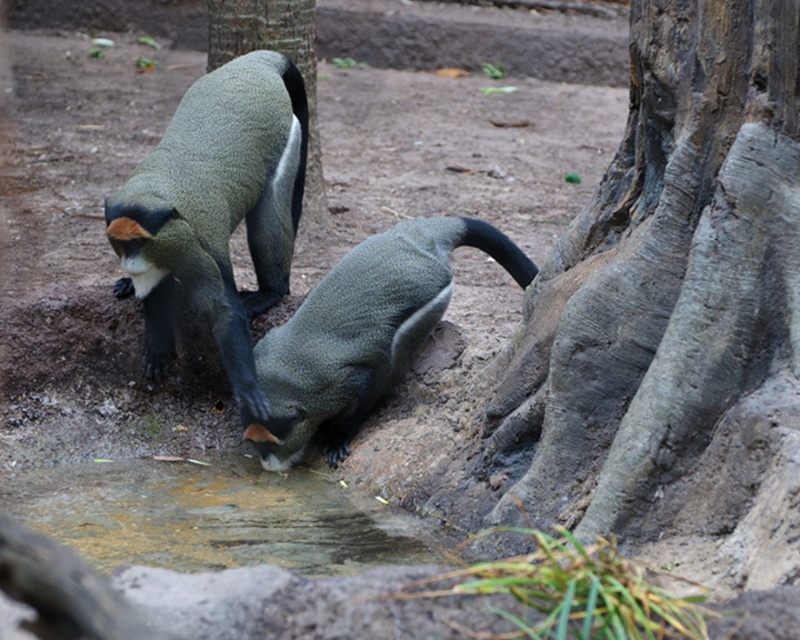
Who is more forward, (708, 1) or (292, 1)?

Point (708, 1)

Can you confirm if gray rough bark tree trunk at right is bigger than green textured monkey at upper center?

Correct, gray rough bark tree trunk at right is larger in size than green textured monkey at upper center.

Does point (621, 497) come closer to viewer compared to point (278, 28)?

Yes, point (621, 497) is closer to viewer.

Where is `gray rough bark tree trunk at right`? Image resolution: width=800 pixels, height=640 pixels. gray rough bark tree trunk at right is located at coordinates (662, 269).

This screenshot has width=800, height=640. In order to click on brown dirt puddle at lower center in this screenshot , I will do `click(212, 516)`.

Is brown dirt puddle at lower center wider than green textured monkey at upper center?

Yes.

Between point (324, 506) and point (282, 13), which one is positioned behind?

Point (282, 13)

At what (x,y) coordinates should I click in order to perform the action: click on brown dirt puddle at lower center. Please return your answer as a coordinate pair (x, y). This screenshot has width=800, height=640. Looking at the image, I should click on (212, 516).

Is point (644, 104) positioned before point (285, 538)?

Yes, point (644, 104) is closer to viewer.

The width and height of the screenshot is (800, 640). In order to click on gray rough bark tree trunk at right in this screenshot , I will do `click(662, 269)`.